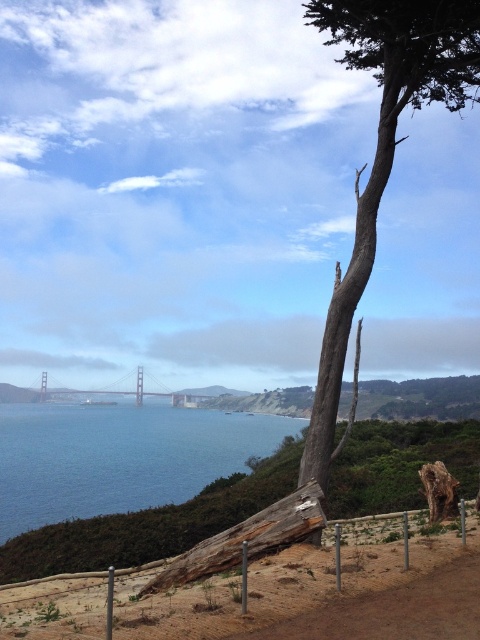
This screenshot has width=480, height=640. What do you see at coordinates (119, 458) in the screenshot? I see `blue water at center` at bounding box center [119, 458].

Can you confirm if blue water at center is positioned to the right of smooth gray bark tree at upper right?

Incorrect, blue water at center is not on the right side of smooth gray bark tree at upper right.

Where is `blue water at center`? blue water at center is located at coordinates (119, 458).

Between point (46, 596) and point (334, 304), which one is positioned in front?

Point (46, 596)

The image size is (480, 640). In order to click on brown wooden fence at lower center in this screenshot , I will do `click(286, 579)`.

Where is `brown wooden fence at lower center`? Image resolution: width=480 pixels, height=640 pixels. brown wooden fence at lower center is located at coordinates (286, 579).

In the scene shown: Which of these two, blue water at center or metallic bridge at center, stands shorter?

metallic bridge at center is shorter.

Between point (96, 500) and point (197, 397), which one is positioned in front?

Point (96, 500)

Image resolution: width=480 pixels, height=640 pixels. In order to click on blue water at center in this screenshot , I will do `click(119, 458)`.